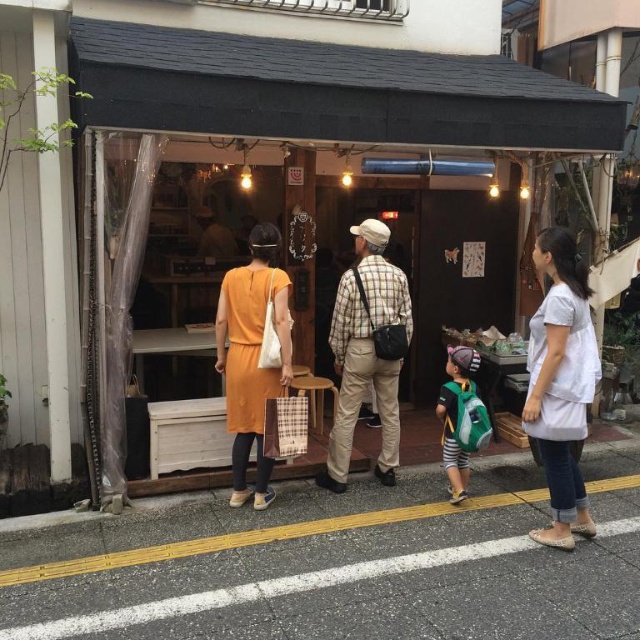
You are a GUI agent. You are given a task and a screenshot of the screen. Output one action in this format:
    pyautogui.click(x=<x>, y=<y>)
    Task: Click on the plaid fabric shirt at center
    This screenshot has width=640, height=640.
    Given the screenshot: What is the action you would take?
    pyautogui.click(x=368, y=352)

Does point (337, 285) come closer to viewer compared to point (234, 332)?

No, (337, 285) is further to viewer.

Is point (387, 333) positioned behind point (237, 420)?

Yes, point (387, 333) is behind point (237, 420).

Locate an element on the screen. The height and width of the screenshot is (640, 640). plaid fabric shirt at center is located at coordinates (368, 352).

Can you confirm if gray asphalt at lower center is smaller than plaid fabric shirt at center?

Incorrect, gray asphalt at lower center is not smaller in size than plaid fabric shirt at center.

Does gray asphalt at lower center appear over plaid fabric shirt at center?

Actually, gray asphalt at lower center is below plaid fabric shirt at center.

Identify the location of gray asphalt at lower center. This screenshot has height=640, width=640. (337, 563).

Which is behind, point (541, 346) or point (410, 300)?

The point (410, 300) is more distant.

Does white cotton shirt at right come behind plaid fabric shirt at center?

No, it is not.

This screenshot has height=640, width=640. What do you see at coordinates (561, 384) in the screenshot?
I see `white cotton shirt at right` at bounding box center [561, 384].

Where is `white cotton shirt at right`? This screenshot has width=640, height=640. white cotton shirt at right is located at coordinates click(561, 384).